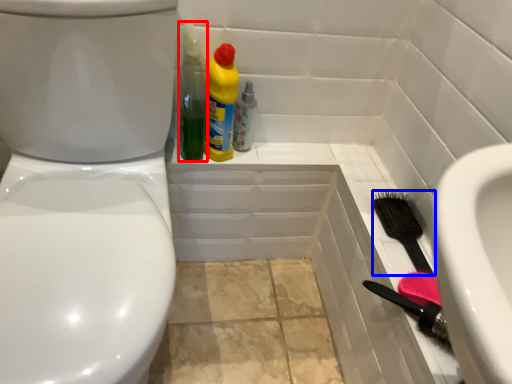
Question: Among these objects, which one is farthest to the camera, cleaning product (highlighted by a red box) or brush (highlighted by a blue box)?

Choices:
 (A) cleaning product
 (B) brush

Answer: (A)